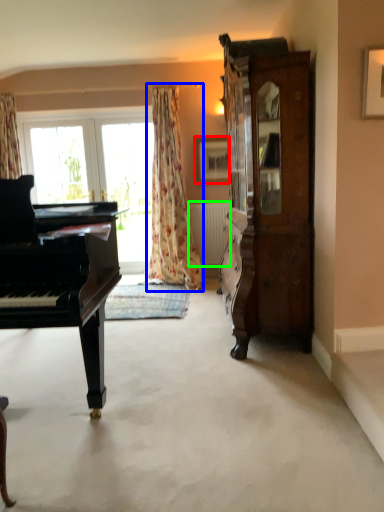
Question: Which object is positioned farthest from picture frame (highlighted by a red box)? Select from curtain (highlighted by a blue box) and radiator (highlighted by a green box).

Choices:
 (A) curtain
 (B) radiator

Answer: (B)